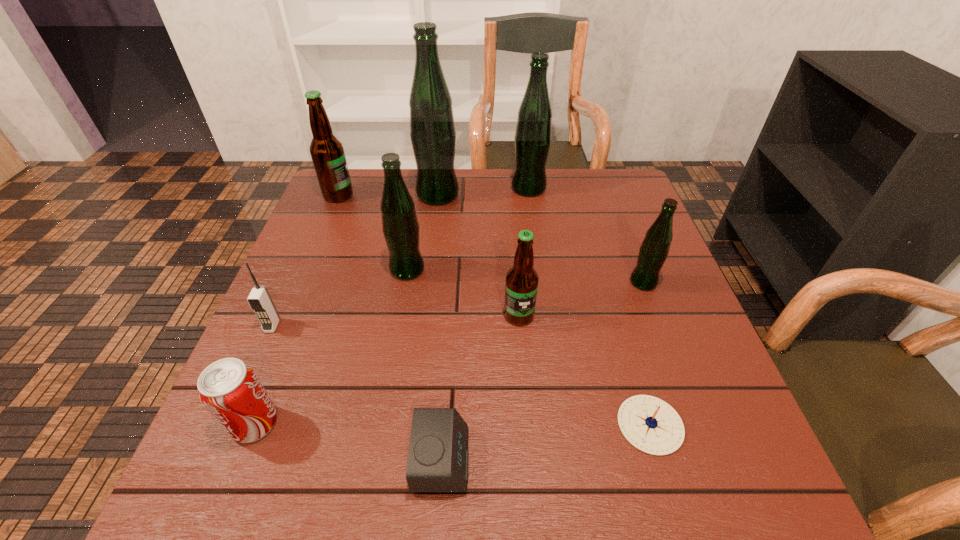
Locate an element on the screen. The width and height of the screenshot is (960, 540). free spot between the cellular telephone and the left brown beer bottle is located at coordinates (305, 260).

In order to click on vacant area that lies between the leftmost beer bottle and the cellular telephone in this screenshot , I will do `click(305, 260)`.

Point out which object is positioned as the eighth nearest to the nearest beer bottle. Please provide its 2D coordinates. Your answer should be formatted as a tuple, i.e. [(x, y)], where the tuple contains the x and y coordinates of a point satisfying the conditions above.

[(259, 299)]

Where is `the fifth closest object to the smaller brown beer bottle`? the fifth closest object to the smaller brown beer bottle is located at coordinates (432, 129).

Locate which beer bottle ranks second in proximity to the farther brown beer bottle. Please provide its 2D coordinates. Your answer should be formatted as a tuple, i.e. [(x, y)], where the tuple contains the x and y coordinates of a point satisfying the conditions above.

[(400, 226)]

Where is `the closest beer bottle to the cellular telephone`? the closest beer bottle to the cellular telephone is located at coordinates (400, 226).

I want to click on green beer bottle that is the second closest to the compass, so click(400, 226).

This screenshot has width=960, height=540. I want to click on green beer bottle that is the second nearest to the third biggest green beer bottle, so click(532, 140).

Identify the location of vacant space that satisfies the following two spatial constraints: 1. on the front side of the shortest object; 2. on the front-facing side of the black alarm clock. (660, 460).

Locate an element on the screen. free space in the image that satisfies the following two spatial constraints: 1. on the back side of the soda can; 2. on the label of the leftmost beer bottle is located at coordinates (344, 195).